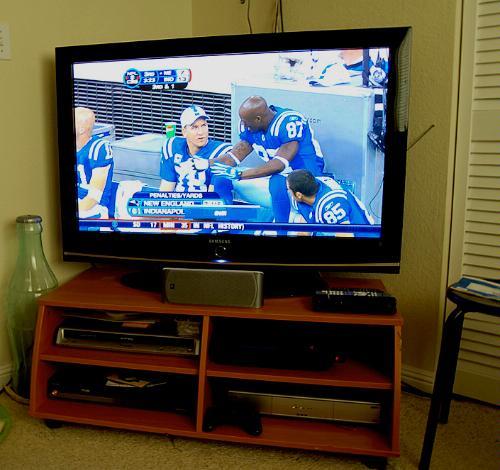
The height and width of the screenshot is (470, 500). In order to click on game controller in this screenshot , I will do `click(226, 417)`.